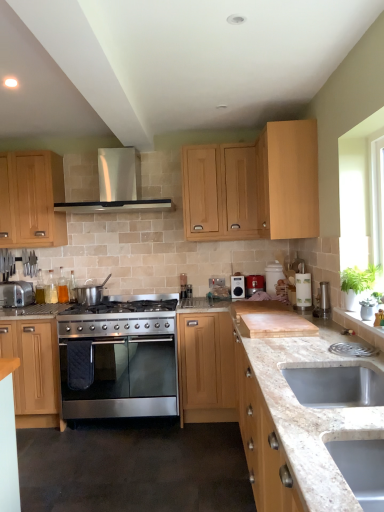
Question: From the image's perspective, would you say satin silver pot at center, the 5th appliance when ordered from back to front, is positioned over light wood cabinet at upper center, which appears as the 2th cabinetry when viewed from the right?

Choices:
 (A) yes
 (B) no

Answer: (B)

Question: Can you confirm if satin silver pot at center, the 4th appliance when ordered from right to left, is wider than light wood cabinet at upper center, which appears as the 2th cabinetry when viewed from the right?

Choices:
 (A) yes
 (B) no

Answer: (B)

Question: Is satin silver pot at center, the 5th appliance when ordered from back to front, bigger than light wood cabinet at upper center, acting as the 4th cabinetry starting from the left?

Choices:
 (A) yes
 (B) no

Answer: (B)

Question: Considering the relative positions of satin silver pot at center, the 3th appliance viewed from the left, and light wood cabinet at upper center, acting as the 4th cabinetry starting from the left, in the image provided, is satin silver pot at center, the 3th appliance viewed from the left, behind light wood cabinet at upper center, acting as the 4th cabinetry starting from the left,?

Choices:
 (A) yes
 (B) no

Answer: (A)

Question: Is satin silver pot at center, the 5th appliance when ordered from back to front, to the right of light wood cabinet at upper center, which appears as the 2th cabinetry when viewed from the right, from the viewer's perspective?

Choices:
 (A) yes
 (B) no

Answer: (B)

Question: Are satin silver pot at center, which is the second appliance in front-to-back order, and light wood cabinet at upper center, which appears as the 2th cabinetry when viewed from the right, far apart?

Choices:
 (A) no
 (B) yes

Answer: (B)

Question: From a real-world perspective, is light wood cabinet at upper center, which appears as the 2th cabinetry when viewed from the right, below translucent glass bottles at left, the 6th appliance when ordered from front to back?

Choices:
 (A) yes
 (B) no

Answer: (B)

Question: Is light wood cabinet at upper center, which appears as the 2th cabinetry when viewed from the right, placed right next to translucent glass bottles at left, the 6th appliance when ordered from front to back?

Choices:
 (A) yes
 (B) no

Answer: (B)

Question: Is the position of light wood cabinet at upper center, acting as the 4th cabinetry starting from the left, less distant than that of translucent glass bottles at left, arranged as the 2th appliance when viewed from the left?

Choices:
 (A) no
 (B) yes

Answer: (B)

Question: Considering the relative positions of light wood cabinet at upper center, which appears as the 2th cabinetry when viewed from the right, and translucent glass bottles at left, the 6th appliance when ordered from front to back, in the image provided, is light wood cabinet at upper center, which appears as the 2th cabinetry when viewed from the right, to the left of translucent glass bottles at left, the 6th appliance when ordered from front to back, from the viewer's perspective?

Choices:
 (A) yes
 (B) no

Answer: (B)

Question: Does light wood cabinet at upper center, acting as the 4th cabinetry starting from the left, have a lesser height compared to translucent glass bottles at left, the 6th appliance when ordered from front to back?

Choices:
 (A) no
 (B) yes

Answer: (A)

Question: Is light wood cabinet at upper center, acting as the 4th cabinetry starting from the left, turned away from translucent glass bottles at left, the 6th appliance when ordered from front to back?

Choices:
 (A) no
 (B) yes

Answer: (A)

Question: Is translucent glass bottles at left, the 5th appliance positioned from the right, outside satin silver pot at center, the 5th appliance when ordered from back to front?

Choices:
 (A) no
 (B) yes

Answer: (B)